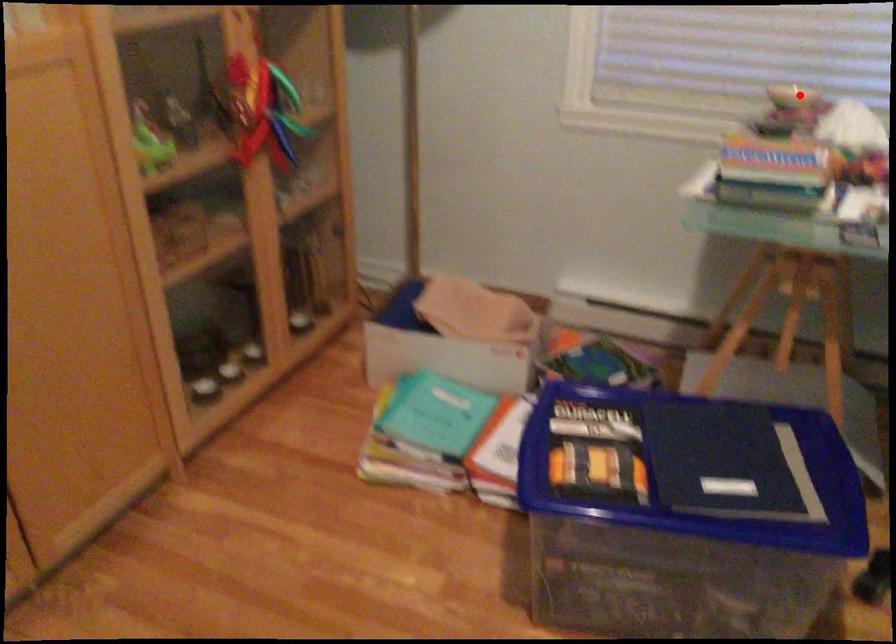
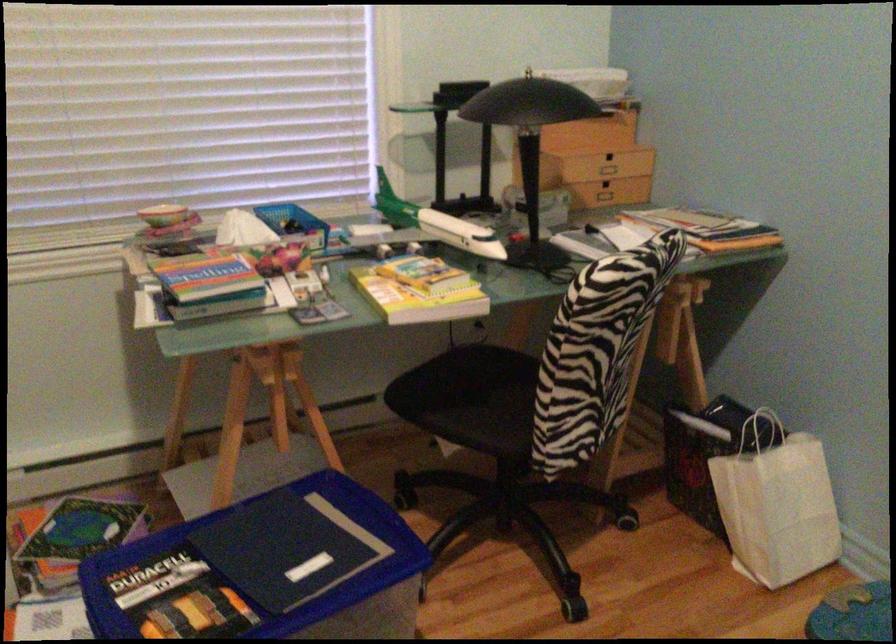
In the second image, find the point that corresponds to the highlighted location in the first image.

(164, 214)